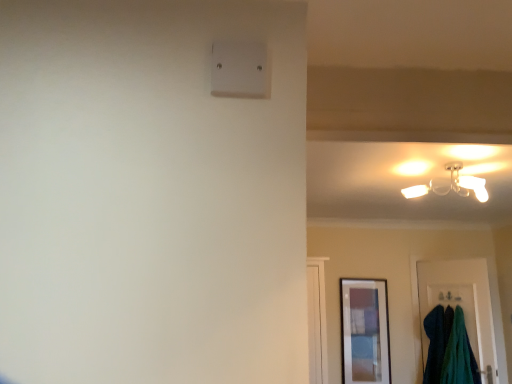
Question: Considering their positions, is white plastic light switch at upper center located in front of or behind velvety teal towels at lower right?

Choices:
 (A) front
 (B) behind

Answer: (A)

Question: From a real-world perspective, is white plastic light switch at upper center above or below velvety teal towels at lower right?

Choices:
 (A) above
 (B) below

Answer: (A)

Question: Which object is positioned farthest from the matte white ceiling light at upper right?

Choices:
 (A) white plastic light switch at upper center
 (B) velvety teal towels at lower right
 (C) wooden framed picture at lower right
 (D) teal fabric door at lower right

Answer: (A)

Question: Considering the real-world distances, which object is farthest from the white plastic light switch at upper center?

Choices:
 (A) teal fabric door at lower right
 (B) wooden framed picture at lower right
 (C) velvety teal towels at lower right
 (D) matte white ceiling light at upper right

Answer: (B)